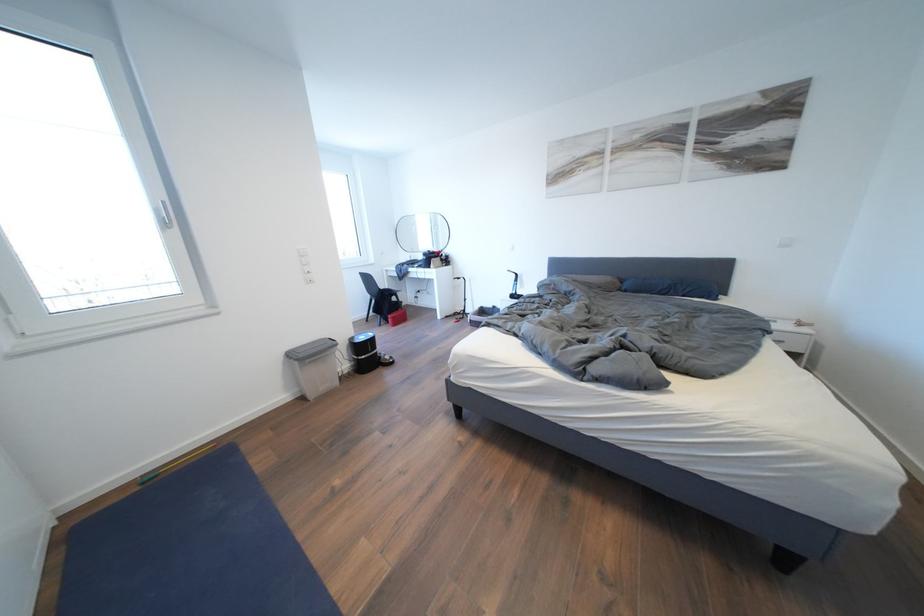
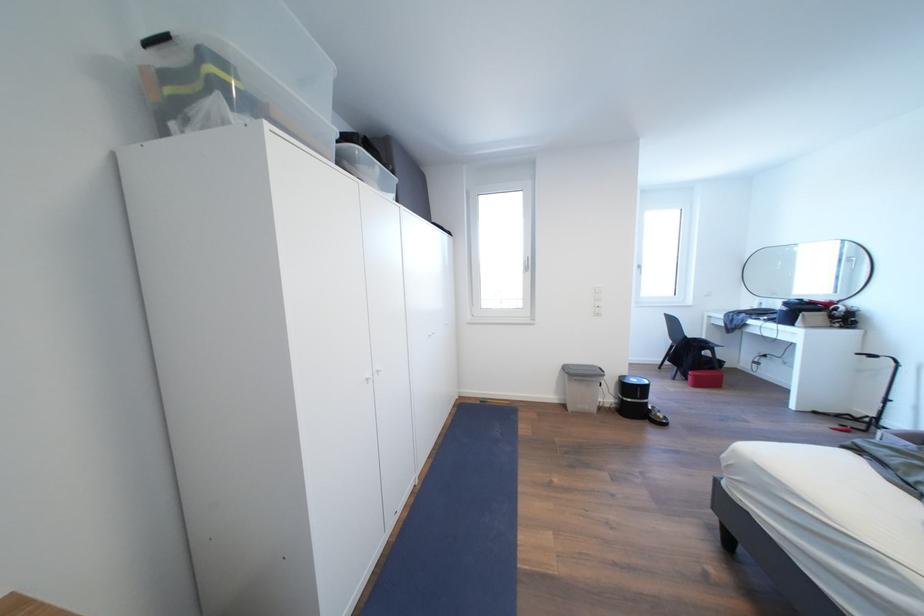
Locate, in the second image, the point that corresponds to point 164,215 in the first image.

(532, 267)